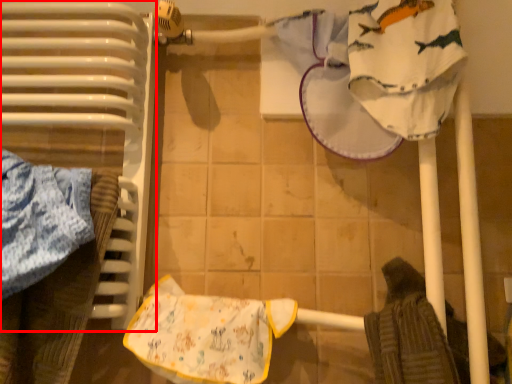
Question: Considering the relative positions of radiator (annotated by the red box) and material in the image provided, where is radiator (annotated by the red box) located with respect to the staircase?

Choices:
 (A) left
 (B) right

Answer: (A)